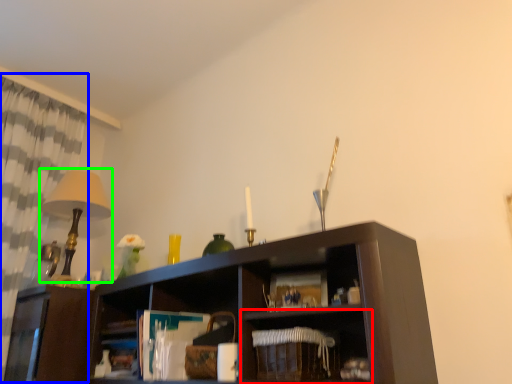
Question: Based on their relative distances, which object is farther from shelf (highlighted by a red box)? Choose from curtain (highlighted by a blue box) and table lamp (highlighted by a green box).

Choices:
 (A) curtain
 (B) table lamp

Answer: (A)